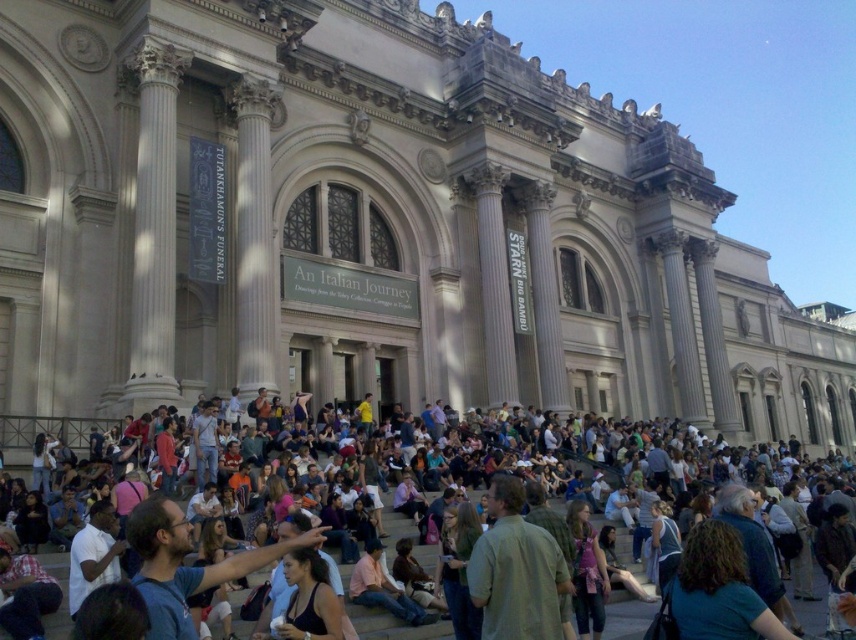
Consider the image. Who is taller, multicolored casual attire at center or green textured jacket at center?

multicolored casual attire at center is taller.

Is point (599, 504) positioned behind point (584, 531)?

Yes, it is behind point (584, 531).

You are a GUI agent. You are given a task and a screenshot of the screen. Output one action in this format:
    pyautogui.click(x=<x>, y=<y>)
    Task: Click on the multicolored casual attire at center
    Image resolution: width=856 pixels, height=640 pixels.
    Given the screenshot: What is the action you would take?
    pyautogui.click(x=462, y=464)

I want to click on dark blue shirt at lower right, so click(718, 589).

This screenshot has height=640, width=856. I want to click on dark blue shirt at lower right, so click(718, 589).

Does multicolored casual attire at center appear on the right side of dark blue shirt at lower right?

Yes, multicolored casual attire at center is to the right of dark blue shirt at lower right.

From the picture: Can you confirm if multicolored casual attire at center is thinner than dark blue shirt at lower right?

Incorrect, multicolored casual attire at center's width is not less than dark blue shirt at lower right's.

This screenshot has width=856, height=640. What do you see at coordinates (462, 464) in the screenshot? I see `multicolored casual attire at center` at bounding box center [462, 464].

You are a GUI agent. You are given a task and a screenshot of the screen. Output one action in this format:
    pyautogui.click(x=<x>, y=<y>)
    Task: Click on the multicolored casual attire at center
    
    Given the screenshot: What is the action you would take?
    pyautogui.click(x=462, y=464)